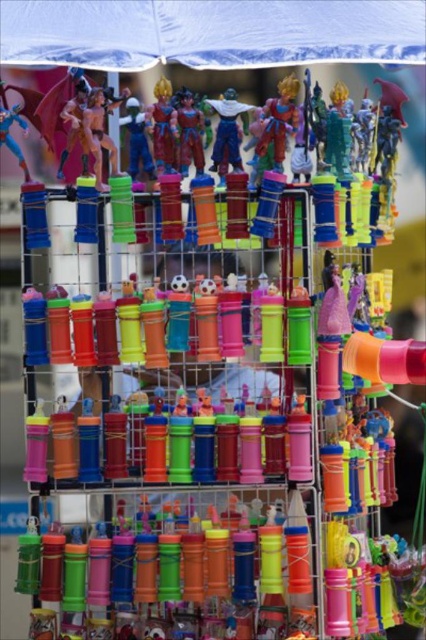
Looking at this image, which is more to the right, matte plastic action figure at center or shiny plastic figure at center?

From the viewer's perspective, matte plastic action figure at center appears more on the right side.

Can you confirm if matte plastic action figure at center is smaller than shiny plastic figure at center?

No.

Which is in front, point (230, 99) or point (169, 144)?

Point (230, 99) is in front.

Find the location of `matte plastic action figure at center`. matte plastic action figure at center is located at coordinates click(x=227, y=132).

Is matte plastic action figure at center below shiny plastic action figure at center?

No, matte plastic action figure at center is not below shiny plastic action figure at center.

Does matte plastic action figure at center lie in front of shiny plastic action figure at center?

Yes, matte plastic action figure at center is in front of shiny plastic action figure at center.

Which is behind, point (236, 145) or point (201, 116)?

The point (236, 145) is more distant.

The width and height of the screenshot is (426, 640). In order to click on matte plastic action figure at center in this screenshot , I will do (x=227, y=132).

Which of these two, shiny plastic figure at center or shiny plastic action figure at center, stands shorter?

Standing shorter between the two is shiny plastic action figure at center.

The width and height of the screenshot is (426, 640). What do you see at coordinates (163, 128) in the screenshot? I see `shiny plastic figure at center` at bounding box center [163, 128].

Identify the location of shiny plastic figure at center. The height and width of the screenshot is (640, 426). (163, 128).